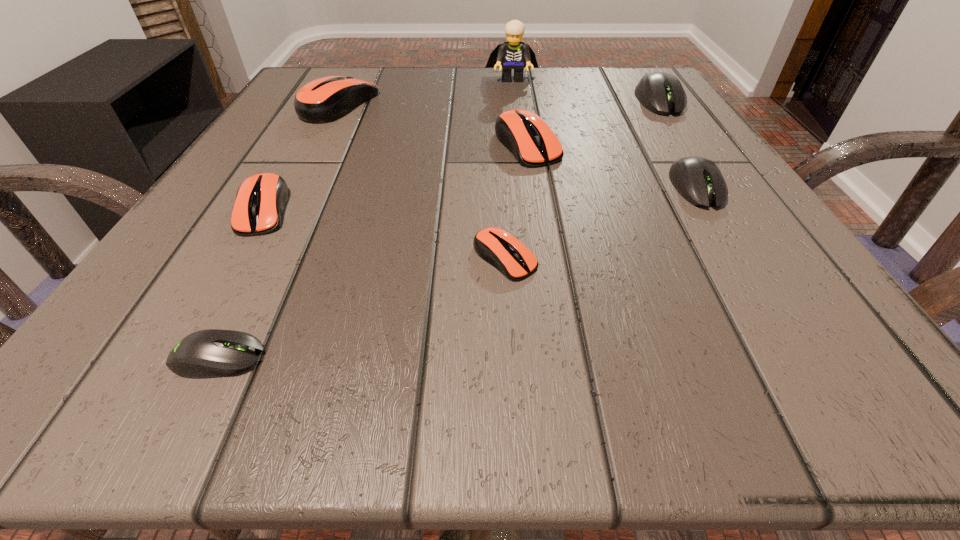
You are a GUI agent. You are given a task and a screenshot of the screen. Output one action in this format:
    pyautogui.click(x=<x>, y=<y>)
    Task: Click on the second closest computer mouse to the smallest orange computer mouse
    The height and width of the screenshot is (540, 960).
    Given the screenshot: What is the action you would take?
    pyautogui.click(x=212, y=353)

Where is `orange computer mouse identified as the fourth closest to the leftmost gray computer mouse`? The width and height of the screenshot is (960, 540). orange computer mouse identified as the fourth closest to the leftmost gray computer mouse is located at coordinates (324, 100).

Select which orange computer mouse appears as the third closest to the tallest object. Please provide its 2D coordinates. Your answer should be formatted as a tuple, i.e. [(x, y)], where the tuple contains the x and y coordinates of a point satisfying the conditions above.

[(260, 200)]

Locate an element on the screen. the second closest gray computer mouse to the second smallest orange computer mouse is located at coordinates (698, 180).

You are a GUI agent. You are given a task and a screenshot of the screen. Output one action in this format:
    pyautogui.click(x=<x>, y=<y>)
    Task: Click on the third closest gray computer mouse to the tallest object
    
    Given the screenshot: What is the action you would take?
    (x=212, y=353)

This screenshot has height=540, width=960. I want to click on free point that satisfies the following two spatial constraints: 1. on the front-facing side of the tallest object; 2. on the wheel side of the nearest gray computer mouse, so click(549, 358).

This screenshot has width=960, height=540. Identify the location of free location that satisfies the following two spatial constraints: 1. on the front-facing side of the tallest object; 2. on the left side of the second biggest orange computer mouse. (521, 145).